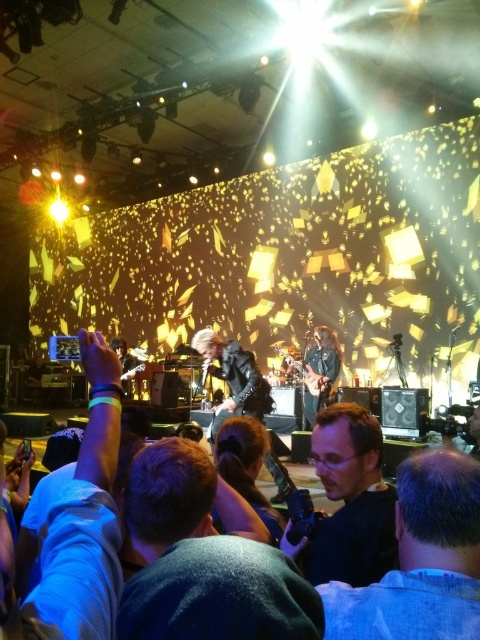
Question: Which object appears closest to the camera in this image?

Choices:
 (A) leather jacket at center
 (B) dark blue shirt at lower right

Answer: (B)

Question: Is dark blue shirt at center closer to the viewer compared to leather jacket at center?

Choices:
 (A) no
 (B) yes

Answer: (B)

Question: Is dark blue denim jacket at lower center wider than white fabric shirt at left?

Choices:
 (A) yes
 (B) no

Answer: (B)

Question: Which point is farther from the camera taking this photo?

Choices:
 (A) (141, 550)
 (B) (370, 528)
 (C) (236, 340)

Answer: (C)

Question: Can you confirm if dark blue shirt at center is positioned to the right of leather jacket at center?

Choices:
 (A) yes
 (B) no

Answer: (A)

Question: Which is nearer to the dark blue shirt at center?

Choices:
 (A) dark blue shirt at lower right
 (B) dark blue denim jacket at lower center

Answer: (A)